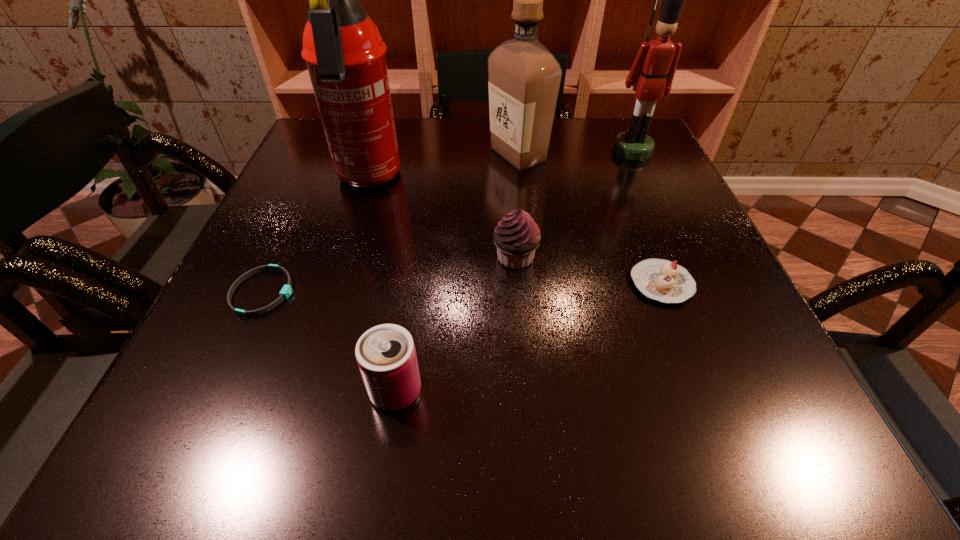
Where is `vacant space located on the front-facing side of the nutcracker`? Image resolution: width=960 pixels, height=540 pixels. vacant space located on the front-facing side of the nutcracker is located at coordinates (646, 180).

Identify the location of vacant space situated on the front-facing side of the liquor. (420, 155).

The image size is (960, 540). In order to click on vacant space located 0.260m on the front-facing side of the liquor in this screenshot , I will do `click(379, 155)`.

I want to click on free location located on the front-facing side of the liquor, so click(334, 155).

The width and height of the screenshot is (960, 540). I want to click on blank area located 0.300m on the back of the taller cupcake, so click(508, 159).

The image size is (960, 540). I want to click on free space located on the left of the nearest object, so click(x=313, y=391).

Image resolution: width=960 pixels, height=540 pixels. What are the coordinates of `free space located 0.290m on the left of the right cupcake` in the screenshot? It's located at (465, 284).

The height and width of the screenshot is (540, 960). Identify the location of vacant area located 0.290m on the buckle of the wristband. (463, 292).

Where is `fire extinguisher located in the far edge section of the desktop`? This screenshot has width=960, height=540. fire extinguisher located in the far edge section of the desktop is located at coordinates (345, 55).

This screenshot has width=960, height=540. What are the coordinates of `nutcracker located in the far edge section of the desktop` in the screenshot? It's located at (651, 75).